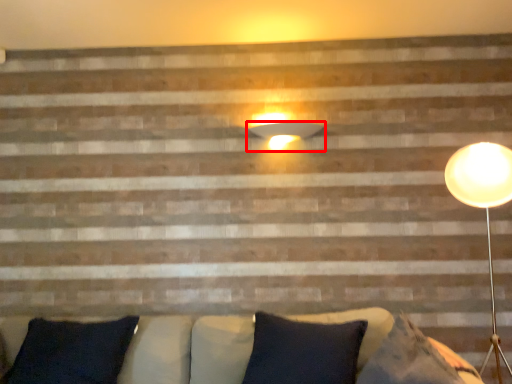
Question: From the image, what is the correct spatial relationship of lamp (annotated by the red box) in relation to pillow?

Choices:
 (A) left
 (B) right

Answer: (B)